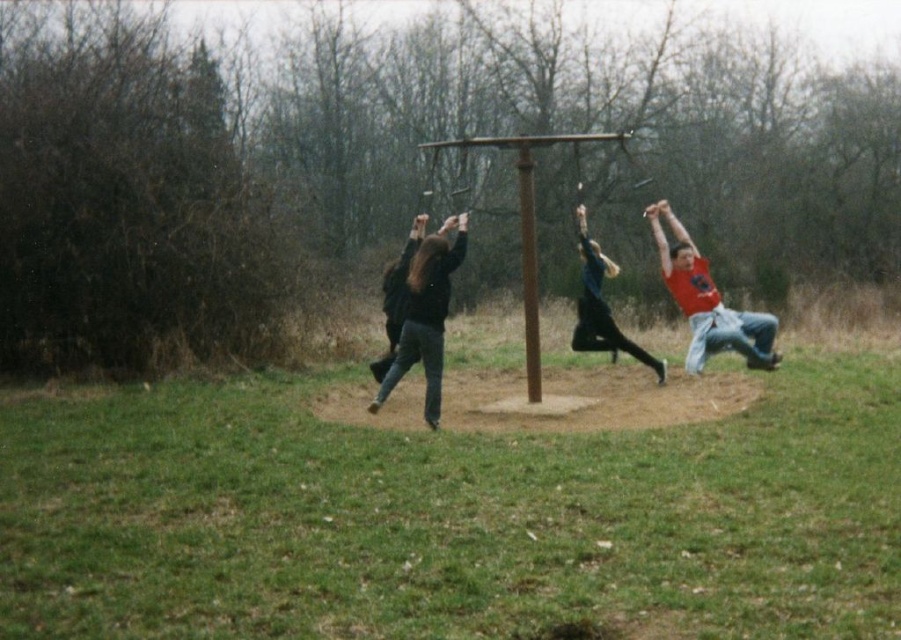
Question: Considering the relative positions of red matte shirt at right and black matte jacket at center in the image provided, where is red matte shirt at right located with respect to black matte jacket at center?

Choices:
 (A) right
 (B) left

Answer: (A)

Question: Which point is closer to the camera?

Choices:
 (A) (584, 224)
 (B) (693, 292)

Answer: (B)

Question: In this image, where is black matte jacket at center located relative to brown wooden pole at center?

Choices:
 (A) below
 (B) above

Answer: (A)

Question: Which point is closer to the camera?

Choices:
 (A) (588, 324)
 (B) (534, 276)

Answer: (B)

Question: Which point is closer to the camera?

Choices:
 (A) (439, 371)
 (B) (698, 356)

Answer: (A)

Question: Is the position of black matte jacket at center more distant than that of black fabric pants at center?

Choices:
 (A) no
 (B) yes

Answer: (A)